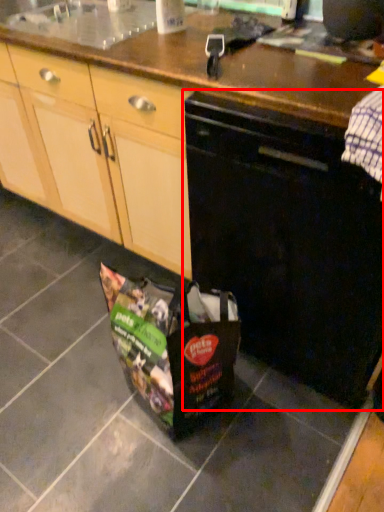
Question: Observing the image, what is the correct spatial positioning of home appliance (annotated by the red box) in reference to kitchen appliance?

Choices:
 (A) left
 (B) right

Answer: (B)